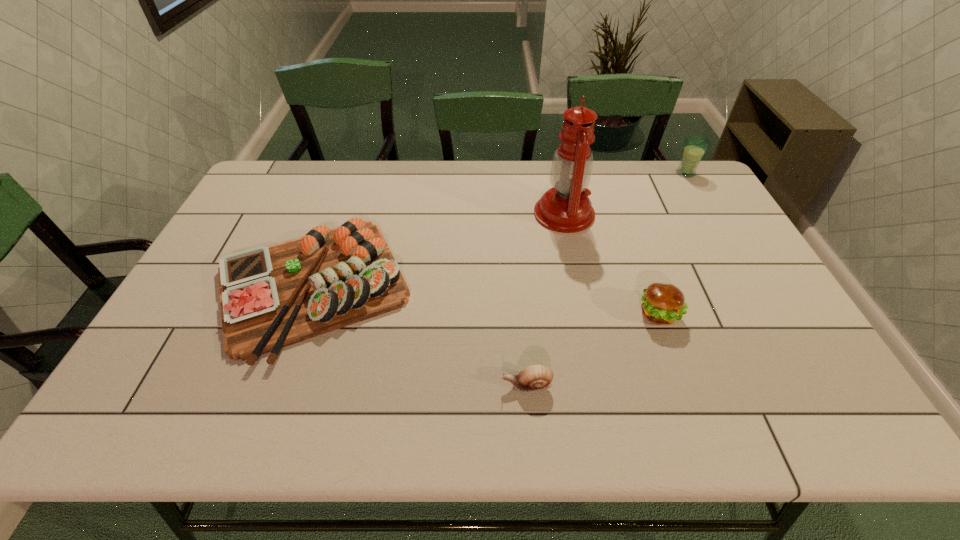
At what (x,y) coordinates should I click in order to perform the action: click on free space between the rightmost object and the hamburger. Please return your answer as a coordinate pair (x, y). This screenshot has width=960, height=540. Looking at the image, I should click on (672, 244).

Locate an element on the screen. The image size is (960, 540). free space between the oil lamp and the platter is located at coordinates (438, 250).

Locate an element on the screen. free space between the escargot and the second tallest object is located at coordinates (607, 279).

I want to click on free space between the second object from right to left and the shortest object, so click(593, 350).

The height and width of the screenshot is (540, 960). I want to click on vacant area that lies between the platter and the third object from right to left, so click(438, 250).

What are the coordinates of `object that is the third closest one to the third object from right to left` in the screenshot? It's located at (271, 297).

This screenshot has height=540, width=960. Identify the location of object that is the second nearest to the fourth object from right to left. (662, 304).

What are the coordinates of `free region that satisfies the following two spatial constraints: 1. on the front side of the leftmost object; 2. on the left side of the hamburger` in the screenshot? It's located at (301, 314).

Identify the location of vacant space that satisfies the following two spatial constraints: 1. on the back side of the fourth shortest object; 2. on the right side of the oil lamp. The width and height of the screenshot is (960, 540). (556, 173).